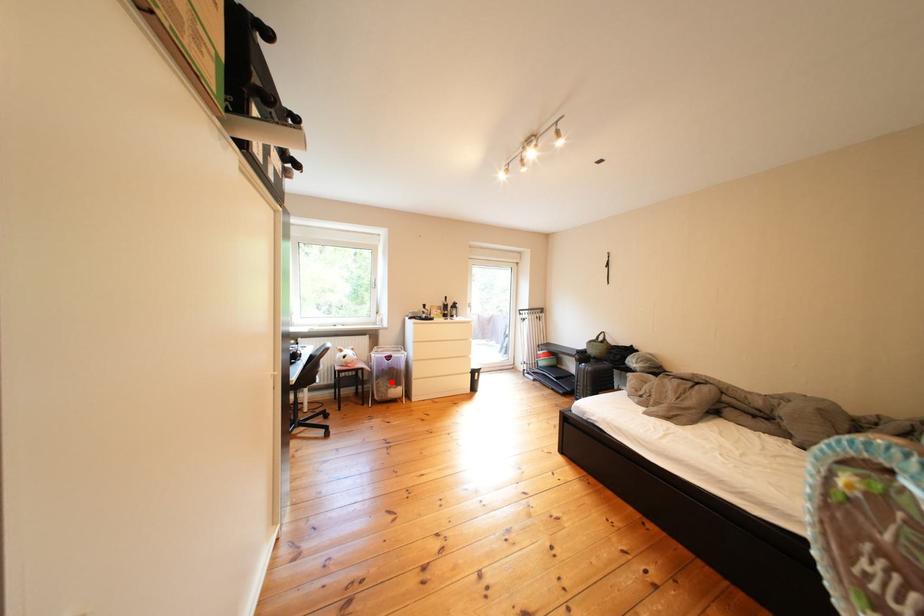
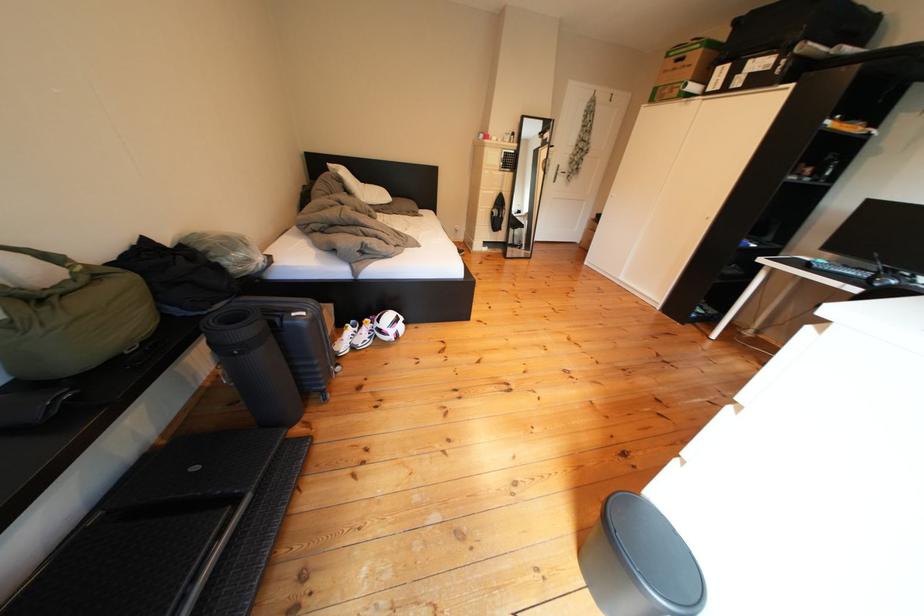
Question: I am providing you with two images of the same scene from different viewpoints. A red point is marked on the first image. Is the red point's position out of view in image 2?

Choices:
 (A) Yes
 (B) No

Answer: (A)